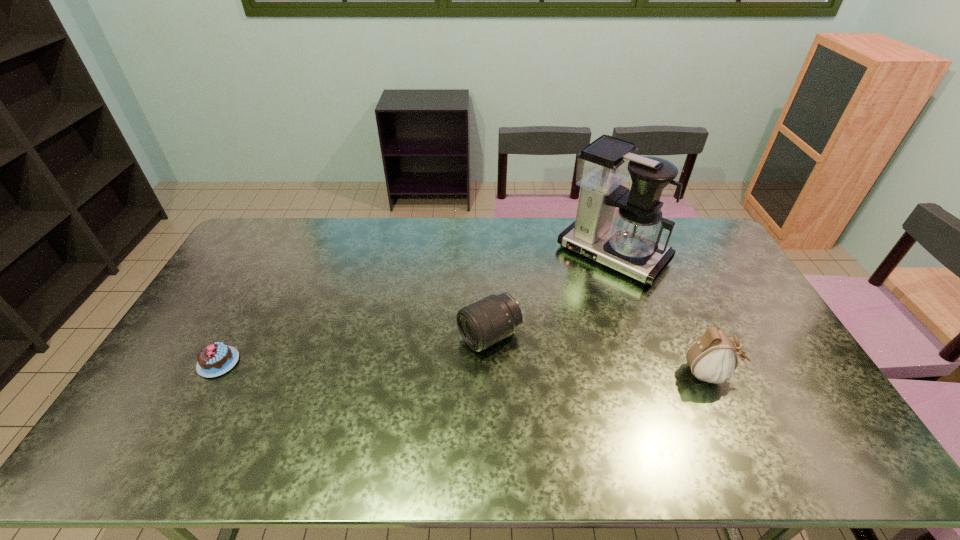
I want to click on vacant space that's between the telephoto lens and the tallest object, so click(x=551, y=295).

Find the location of a particular element. The image size is (960, 540). free space between the third object from right to left and the farthest object is located at coordinates (551, 295).

The image size is (960, 540). I want to click on free space between the third shortest object and the third tallest object, so click(599, 355).

Find the location of a particular element. object that stands as the second closest to the coffee maker is located at coordinates (712, 357).

Identify the location of object that can be found as the second closest to the farthest object. 712,357.

Find the location of `free point that satisfies the following two spatial constraints: 1. on the front side of the chocolate cake; 2. on the front-facing side of the pouch`. free point that satisfies the following two spatial constraints: 1. on the front side of the chocolate cake; 2. on the front-facing side of the pouch is located at coordinates (213, 374).

At what (x,y) coordinates should I click in order to perform the action: click on free location that satisfies the following two spatial constraints: 1. on the front side of the pouch; 2. on the front-facing side of the chocolate cake. Please return your answer as a coordinate pair (x, y). Looking at the image, I should click on (213, 374).